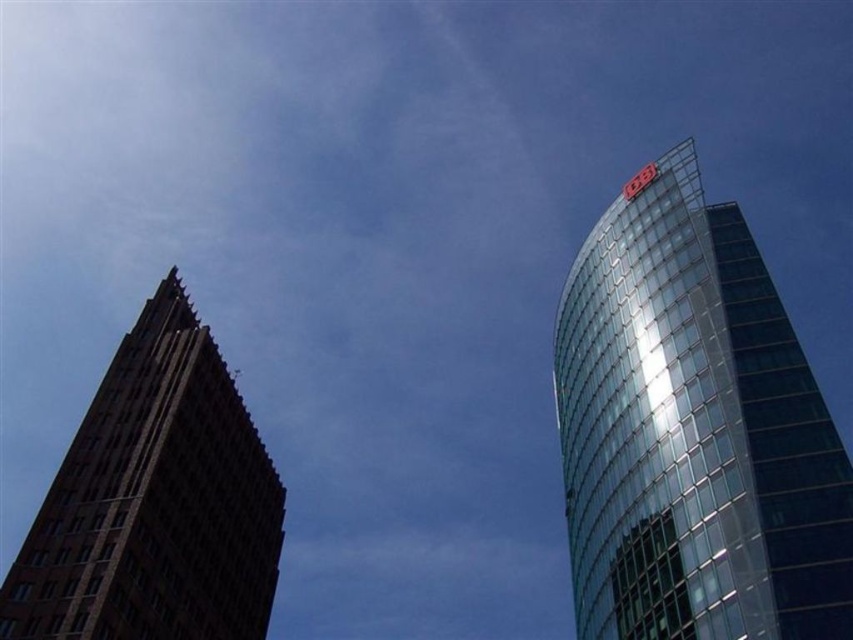
You are standing in the middle of the street between the transparent glass tower at right and the brown brick building at left. Which building is closer to your right side?

The transparent glass tower at right is to the right of the brown brick building at left, so it is closer to your right side.

You are an architect analyzing the two buildings in the image. Based on their heights, which one would require a taller crane for construction? Please consider the transparent glass tower at right and the brown brick building at left in your answer.

The brown brick building at left is taller than the transparent glass tower at right, so a taller crane would be needed for constructing the brown brick building at left.

You are a drone operator tasked with flying a drone between the transparent glass tower at right and the brown brick building at left. The drone has a maximum flight distance of 40 meters. Can the drone safely complete this task without exceeding its range?

The distance between the transparent glass tower at right and the brown brick building at left is 37.29 meters, which is within the drone operator drone has a maximum flight distance of 40 meters. The drone can safely complete the task without exceeding its range.